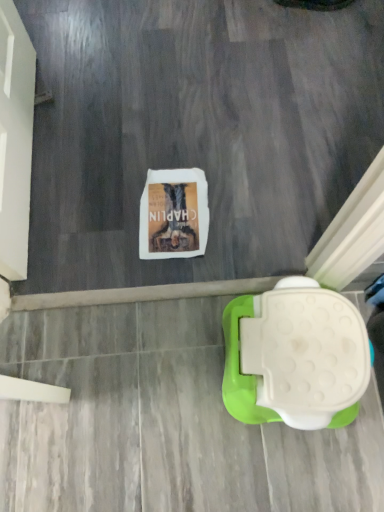
Where is `free location to the left of white plastic toilet at lower right`? This screenshot has width=384, height=512. free location to the left of white plastic toilet at lower right is located at coordinates (168, 357).